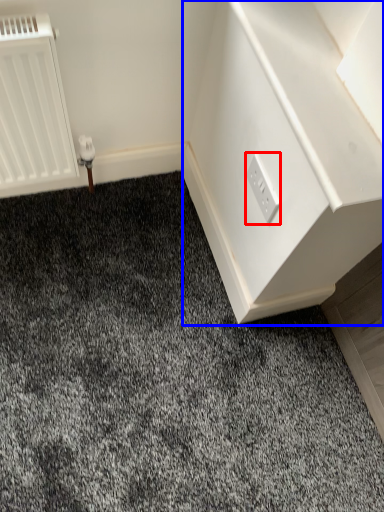
Question: Among these objects, which one is nearest to the camera, power plugs and sockets (highlighted by a red box) or dresser (highlighted by a blue box)?

Choices:
 (A) power plugs and sockets
 (B) dresser

Answer: (B)